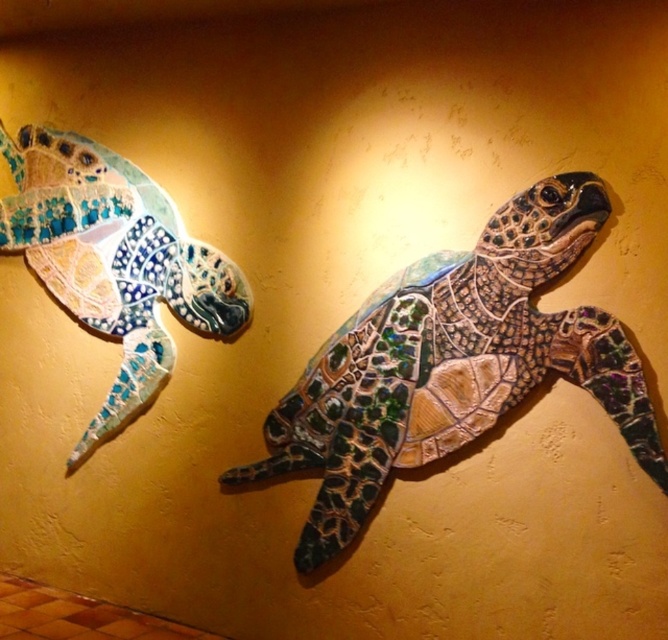
Which is below, shiny mosaic turtle at center or shiny mosaic turtle at left?

Positioned lower is shiny mosaic turtle at center.

Does shiny mosaic turtle at center have a lesser height compared to shiny mosaic turtle at left?

Yes, shiny mosaic turtle at center is shorter than shiny mosaic turtle at left.

Describe the element at coordinates (452, 364) in the screenshot. I see `shiny mosaic turtle at center` at that location.

Find the location of `shiny mosaic turtle at center`. shiny mosaic turtle at center is located at coordinates (452, 364).